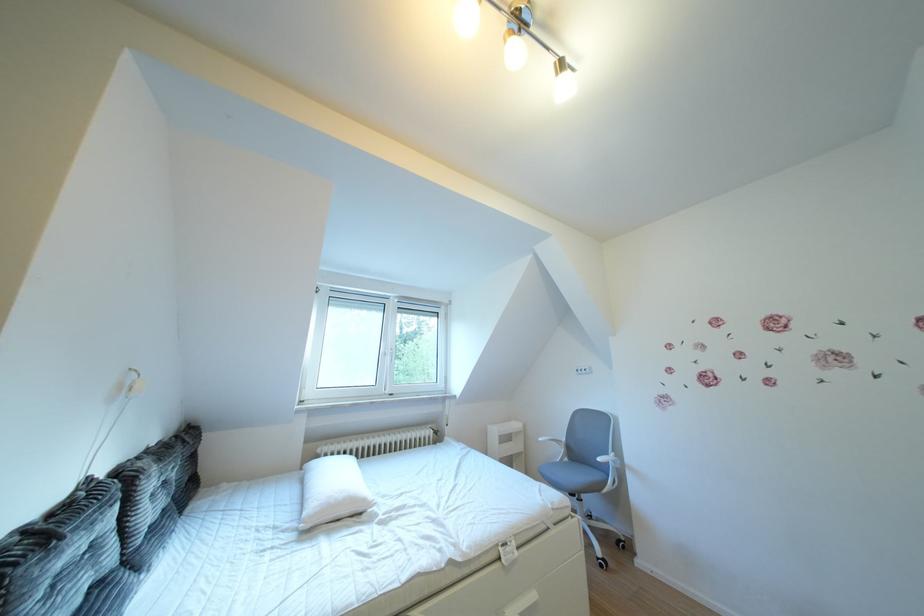
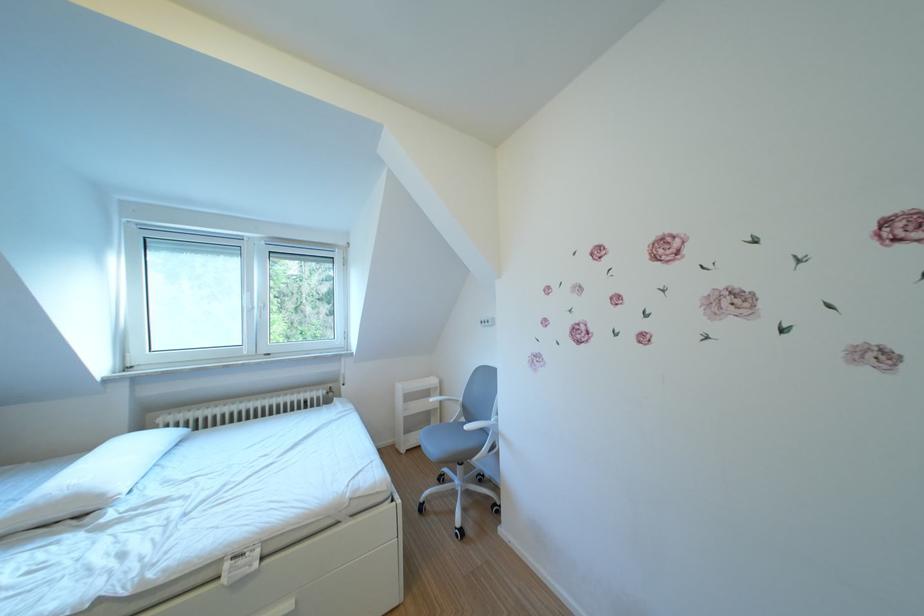
Where in the second image is the point corresponding to (x=580, y=464) from the first image?

(477, 424)